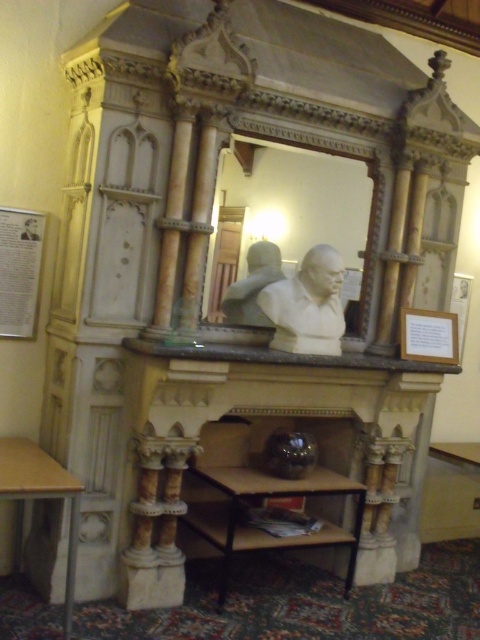
Question: Which point appears closest to the camera in this image?

Choices:
 (A) (264, 262)
 (B) (68, 563)
 (C) (216, 513)

Answer: (B)

Question: Which of these objects is positioned closest to the satin bronze bust at center?

Choices:
 (A) wooden table at lower left
 (B) metallic black table at center
 (C) white marble bust at center

Answer: (C)

Question: In this image, where is white marble bust at center located relative to satin bronze bust at center?

Choices:
 (A) above
 (B) below

Answer: (B)

Question: Can you confirm if wooden table at lower left is thinner than satin bronze bust at center?

Choices:
 (A) yes
 (B) no

Answer: (B)

Question: Among these points, which one is nearest to the camera?

Choices:
 (A) (257, 538)
 (B) (307, 320)
 (C) (252, 244)
 (D) (0, 465)

Answer: (D)

Question: Does white marble bust at center have a greater width compared to wooden table at lower left?

Choices:
 (A) no
 (B) yes

Answer: (A)